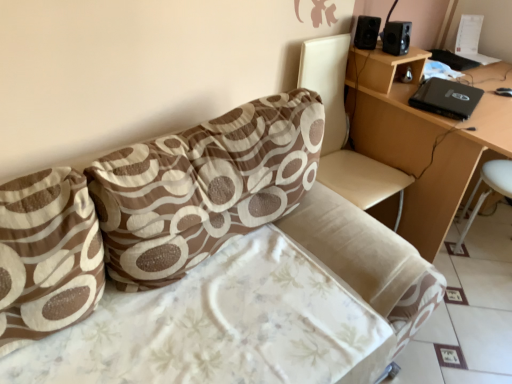
Question: Is black matte speaker at upper right, which is the 2th speaker in right-to-left order, beside brown printed fabric pillow at left, the 1th pillow positioned from the left?

Choices:
 (A) no
 (B) yes

Answer: (A)

Question: Does black matte speaker at upper right, which is the first speaker from left to right, have a greater width compared to brown printed fabric pillow at left, positioned as the second pillow in right-to-left order?

Choices:
 (A) no
 (B) yes

Answer: (A)

Question: Would you say black matte speaker at upper right, which is the 2th speaker in right-to-left order, is a long distance from brown printed fabric pillow at left, positioned as the second pillow in right-to-left order?

Choices:
 (A) yes
 (B) no

Answer: (A)

Question: Is black matte speaker at upper right, which is the first speaker from left to right, to the left of brown printed fabric pillow at left, positioned as the second pillow in right-to-left order, from the viewer's perspective?

Choices:
 (A) no
 (B) yes

Answer: (A)

Question: Would you say black matte speaker at upper right, which is the 2th speaker in right-to-left order, is outside brown printed fabric pillow at left, the 1th pillow positioned from the left?

Choices:
 (A) yes
 (B) no

Answer: (A)

Question: Is black matte speaker at upper right, which is the first speaker from left to right, aimed at brown printed fabric pillow at left, positioned as the second pillow in right-to-left order?

Choices:
 (A) yes
 (B) no

Answer: (B)

Question: Is white plastic bar stool at lower right located within light brown wooden table at upper right?

Choices:
 (A) yes
 (B) no

Answer: (A)

Question: Is light brown wooden table at upper right at the right side of white plastic bar stool at lower right?

Choices:
 (A) no
 (B) yes

Answer: (A)

Question: From the image's perspective, is light brown wooden table at upper right beneath white plastic bar stool at lower right?

Choices:
 (A) no
 (B) yes

Answer: (A)

Question: Does light brown wooden table at upper right come behind white plastic bar stool at lower right?

Choices:
 (A) yes
 (B) no

Answer: (B)

Question: Considering the relative sizes of light brown wooden table at upper right and white plastic bar stool at lower right in the image provided, is light brown wooden table at upper right shorter than white plastic bar stool at lower right?

Choices:
 (A) yes
 (B) no

Answer: (B)

Question: From a real-world perspective, is light brown wooden table at upper right physically above white plastic bar stool at lower right?

Choices:
 (A) yes
 (B) no

Answer: (A)

Question: Is black matte speaker at upper right, which is the 2th speaker in right-to-left order, looking in the opposite direction of light brown wooden table at upper right?

Choices:
 (A) yes
 (B) no

Answer: (B)